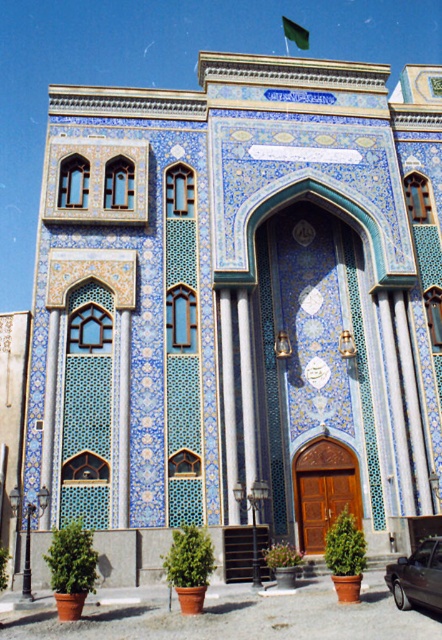
Question: Is metallic gray car at lower right smaller than green fabric flag at upper center?

Choices:
 (A) yes
 (B) no

Answer: (A)

Question: Which object appears closest to the camera in this image?

Choices:
 (A) metallic gray car at lower right
 (B) green fabric flag at upper center

Answer: (A)

Question: Does metallic gray car at lower right have a lesser width compared to green fabric flag at upper center?

Choices:
 (A) yes
 (B) no

Answer: (A)

Question: Which of the following is the closest to the observer?

Choices:
 (A) (305, 33)
 (B) (397, 608)

Answer: (B)

Question: Can you confirm if metallic gray car at lower right is smaller than green fabric flag at upper center?

Choices:
 (A) yes
 (B) no

Answer: (A)